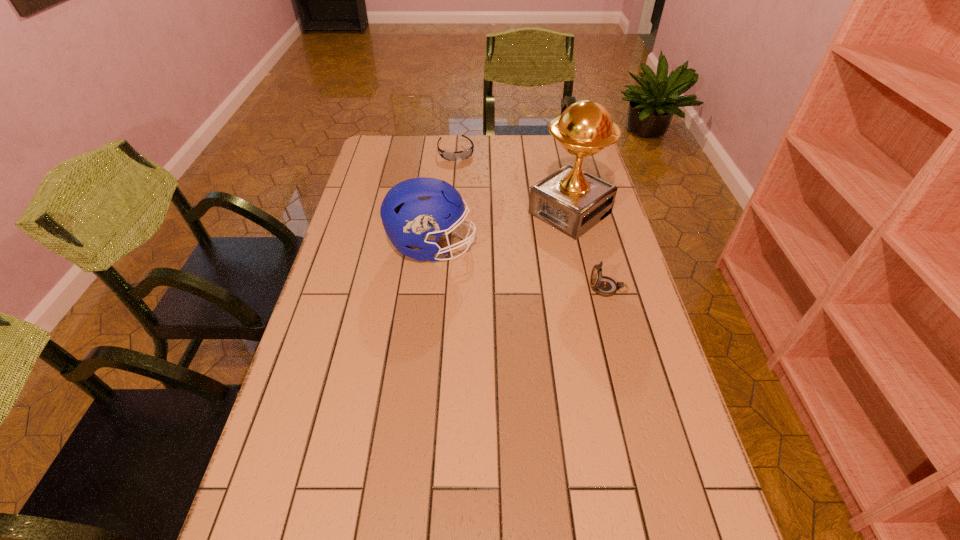
This screenshot has width=960, height=540. Identify the location of free space on the desktop that is between the football helmet and the compass and is positioned on the front-facing side of the tallest object. (500, 263).

The width and height of the screenshot is (960, 540). I want to click on vacant spot on the desktop that is between the second tallest object and the nearest object and is positioned on the lenses of the farthest object, so click(x=504, y=264).